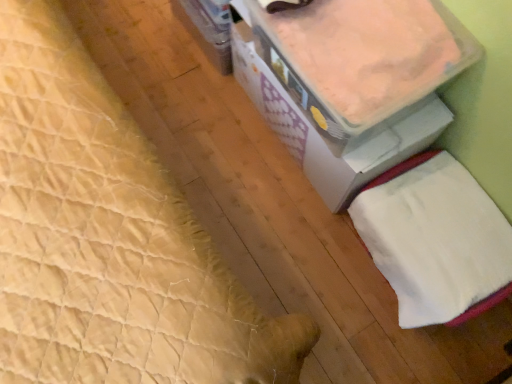
Question: Is white cardboard storage box at upper right closer to the viewer compared to white soft towel at lower right?

Choices:
 (A) yes
 (B) no

Answer: (A)

Question: From a real-world perspective, is white cardboard storage box at upper right positioned over white soft towel at lower right based on gravity?

Choices:
 (A) no
 (B) yes

Answer: (B)

Question: Does white cardboard storage box at upper right have a greater width compared to white soft towel at lower right?

Choices:
 (A) yes
 (B) no

Answer: (A)

Question: Is white cardboard storage box at upper right taller than white soft towel at lower right?

Choices:
 (A) no
 (B) yes

Answer: (A)

Question: Does white cardboard storage box at upper right appear on the right side of white soft towel at lower right?

Choices:
 (A) yes
 (B) no

Answer: (B)

Question: Can you confirm if white cardboard storage box at upper right is thinner than white soft towel at lower right?

Choices:
 (A) no
 (B) yes

Answer: (A)

Question: Considering the relative sizes of white soft towel at lower right and white cardboard storage box at upper right in the image provided, is white soft towel at lower right shorter than white cardboard storage box at upper right?

Choices:
 (A) yes
 (B) no

Answer: (B)

Question: Is white soft towel at lower right closer to camera compared to white cardboard storage box at upper right?

Choices:
 (A) yes
 (B) no

Answer: (B)

Question: From a real-world perspective, is white soft towel at lower right located beneath white cardboard storage box at upper right?

Choices:
 (A) yes
 (B) no

Answer: (A)

Question: Considering the relative sizes of white soft towel at lower right and white cardboard storage box at upper right in the image provided, is white soft towel at lower right taller than white cardboard storage box at upper right?

Choices:
 (A) yes
 (B) no

Answer: (A)

Question: Is white soft towel at lower right beside white cardboard storage box at upper right?

Choices:
 (A) no
 (B) yes

Answer: (A)

Question: Is white soft towel at lower right aimed at white cardboard storage box at upper right?

Choices:
 (A) yes
 (B) no

Answer: (B)

Question: Looking at the image, does white soft towel at lower right seem bigger or smaller compared to white cardboard storage box at upper right?

Choices:
 (A) small
 (B) big

Answer: (B)